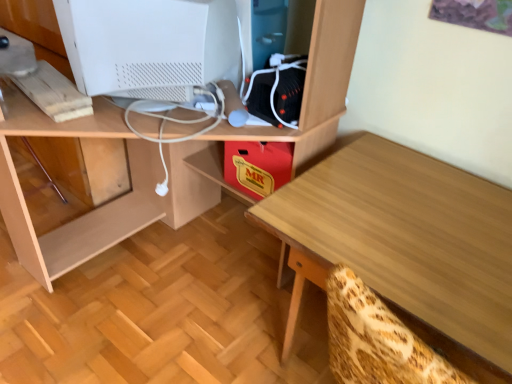
Locate an element on the screen. This screenshot has height=384, width=512. blank space above light wood table at center (from a real-world perspective) is located at coordinates (382, 230).